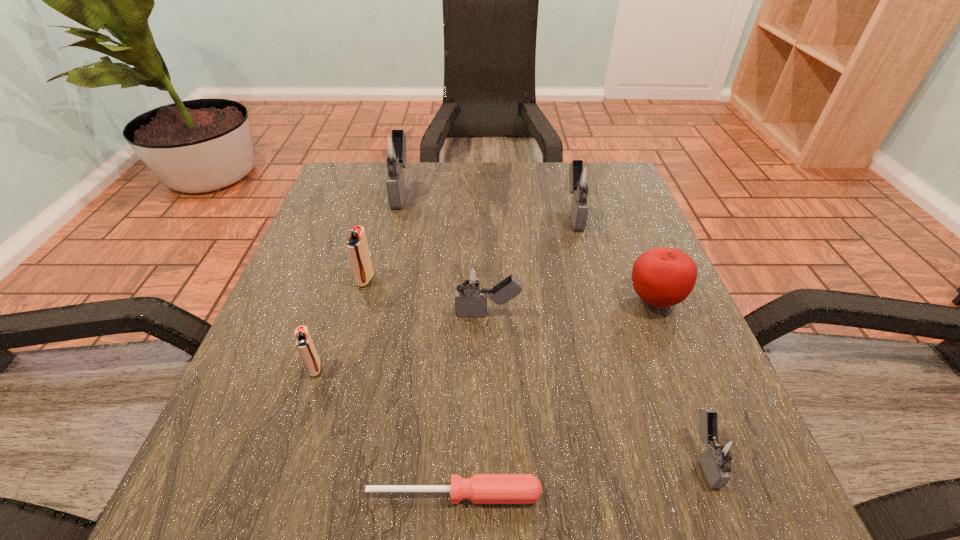
Locate an element on the screen. This screenshot has height=540, width=960. vacant region located 0.150m on the back of the sixth farthest object is located at coordinates (339, 295).

In order to click on vacant space located 0.180m on the left of the nearest gray igniter in this screenshot , I will do `click(554, 457)`.

At what (x,y) coordinates should I click in order to perform the action: click on free spot located 0.200m on the right of the red screwdriver. Please return your answer as a coordinate pair (x, y). The width and height of the screenshot is (960, 540). Looking at the image, I should click on tap(697, 494).

Identify the location of igniter that is at the near edge. The image size is (960, 540). (722, 455).

What are the coordinates of `screwdriver at the near edge` in the screenshot? It's located at (481, 488).

Locate an element on the screen. apple that is positioned at the right edge is located at coordinates (662, 277).

The image size is (960, 540). Find the location of `object that is positioned at the far left corner`. object that is positioned at the far left corner is located at coordinates (391, 148).

At what (x,y) coordinates should I click in order to perform the action: click on object at the far right corner. Please return your answer as a coordinate pair (x, y). Looking at the image, I should click on (583, 180).

Image resolution: width=960 pixels, height=540 pixels. Find the location of `object that is at the near right corner`. object that is at the near right corner is located at coordinates (722, 455).

In the image, there is a desktop. Find the location of `vacant space at the far edge`. vacant space at the far edge is located at coordinates (485, 213).